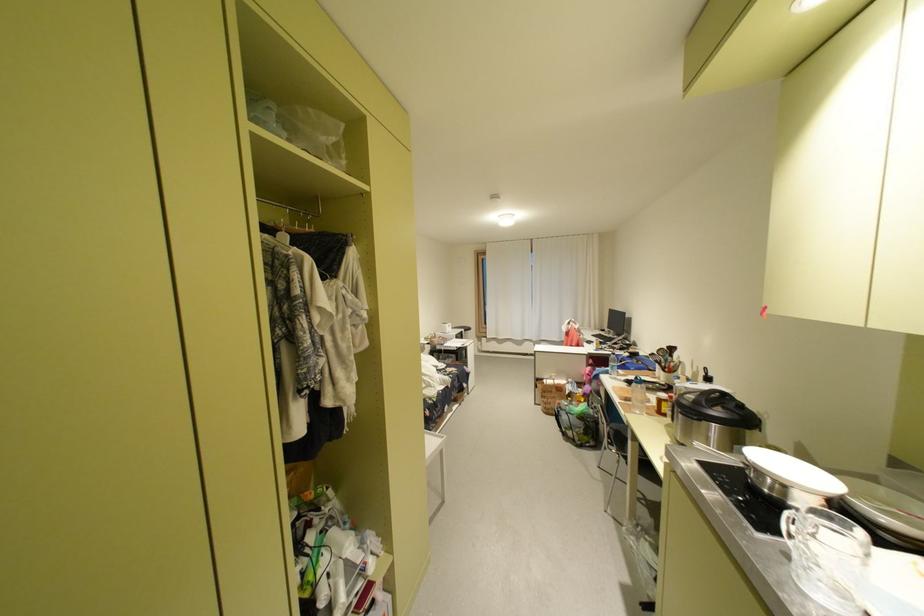
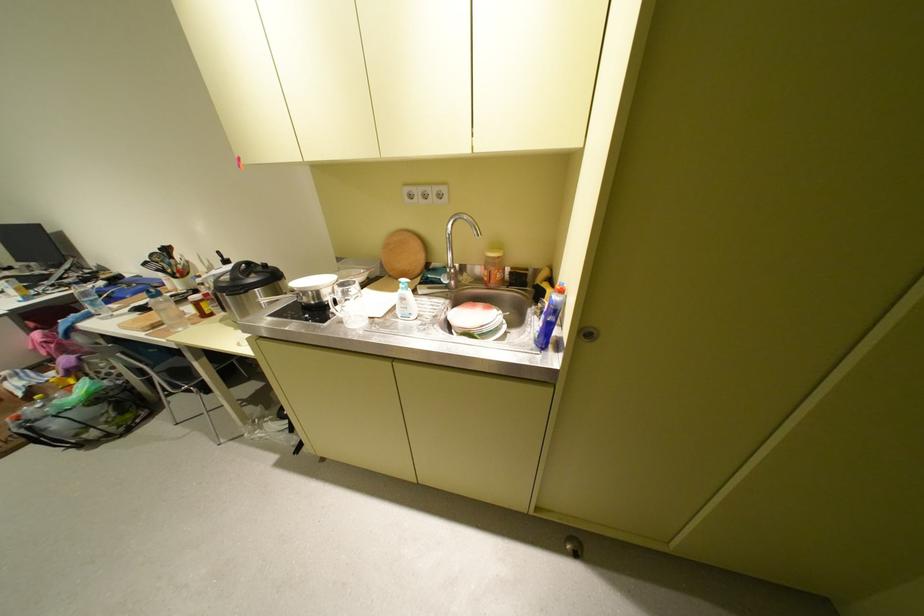
Find the pixel in the second image that matches (x=701, y=398) in the first image.

(237, 277)